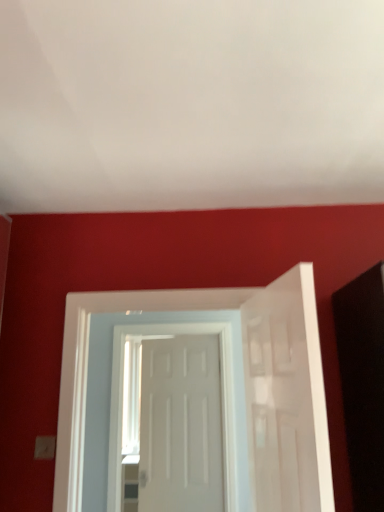
Question: Can you confirm if white matte door at center, the 1th door viewed from the back, is thinner than white matte door at right, marked as the first door in a front-to-back arrangement?

Choices:
 (A) no
 (B) yes

Answer: (B)

Question: From the image's perspective, is white matte door at center, the 1th door viewed from the back, above white matte door at right, the 3th door when ordered from back to front?

Choices:
 (A) no
 (B) yes

Answer: (A)

Question: From the image's perspective, is white matte door at center, the 1th door viewed from the back, located beneath white matte door at right, the 3th door when ordered from back to front?

Choices:
 (A) no
 (B) yes

Answer: (B)

Question: Can you confirm if white matte door at center, marked as the 3th door in a front-to-back arrangement, is shorter than white matte door at right, the 3th door when ordered from back to front?

Choices:
 (A) yes
 (B) no

Answer: (B)

Question: From a real-world perspective, is white matte door at center, the 1th door viewed from the back, positioned under white matte door at right, marked as the first door in a front-to-back arrangement, based on gravity?

Choices:
 (A) no
 (B) yes

Answer: (B)

Question: Is white matte door at center, marked as the 3th door in a front-to-back arrangement, facing towards white matte door at right, marked as the first door in a front-to-back arrangement?

Choices:
 (A) yes
 (B) no

Answer: (B)

Question: Is white glossy door at center, which is counted as the 2th door, starting from the front, outside white matte door at right, the 3th door when ordered from back to front?

Choices:
 (A) yes
 (B) no

Answer: (A)

Question: Is white glossy door at center, acting as the 2th door starting from the back, behind white matte door at right, the 3th door when ordered from back to front?

Choices:
 (A) yes
 (B) no

Answer: (A)

Question: Is white glossy door at center, acting as the 2th door starting from the back, taller than white matte door at right, marked as the first door in a front-to-back arrangement?

Choices:
 (A) yes
 (B) no

Answer: (A)

Question: Is white glossy door at center, which is counted as the 2th door, starting from the front, closer to the viewer compared to white matte door at right, marked as the first door in a front-to-back arrangement?

Choices:
 (A) yes
 (B) no

Answer: (B)

Question: From a real-world perspective, is white glossy door at center, which is counted as the 2th door, starting from the front, located beneath white matte door at right, the 3th door when ordered from back to front?

Choices:
 (A) yes
 (B) no

Answer: (B)

Question: Does white glossy door at center, acting as the 2th door starting from the back, have a lesser height compared to white matte door at right, marked as the first door in a front-to-back arrangement?

Choices:
 (A) no
 (B) yes

Answer: (A)

Question: Can we say white matte door at center, the 1th door viewed from the back, lies outside white glossy door at center, acting as the 2th door starting from the back?

Choices:
 (A) no
 (B) yes

Answer: (B)